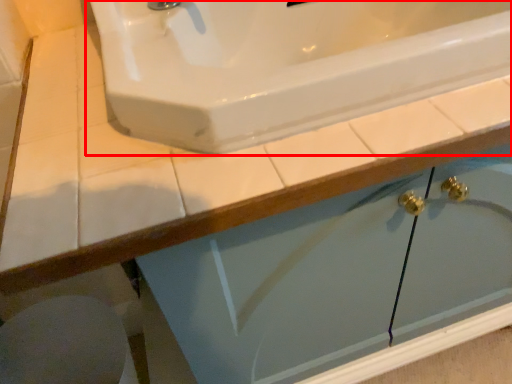
Question: Observing the image, what is the correct spatial positioning of sink (annotated by the red box) in reference to porcelain?

Choices:
 (A) right
 (B) left

Answer: (A)